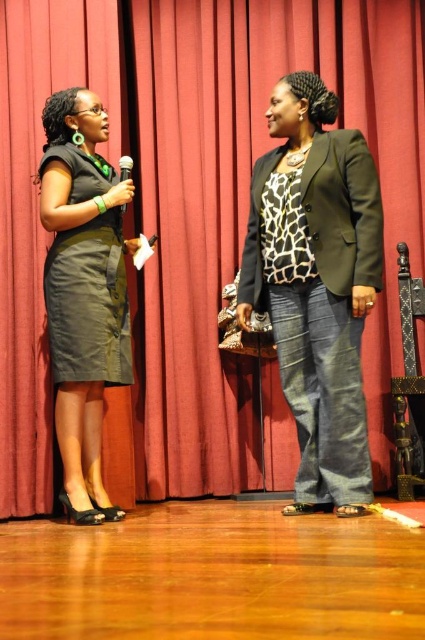
Does matte olive green skirt at left appear over metallic silver microphone at center?

Incorrect, matte olive green skirt at left is not positioned above metallic silver microphone at center.

Can you confirm if matte olive green skirt at left is positioned below metallic silver microphone at center?

Indeed, matte olive green skirt at left is positioned under metallic silver microphone at center.

Where is `matte olive green skirt at left`? Image resolution: width=425 pixels, height=640 pixels. matte olive green skirt at left is located at coordinates (88, 304).

Locate an element on the screen. matte olive green skirt at left is located at coordinates (88, 304).

Between matte green blazer at center and matte olive green skirt at left, which one is positioned higher?

matte olive green skirt at left is above.

Is point (277, 253) positioned after point (122, 372)?

That is False.

Which is in front, point (291, 243) or point (64, 248)?

Point (291, 243)

Find the location of `matte green blazer at center`. matte green blazer at center is located at coordinates (317, 284).

Does wooden floor at lower center appear on the left side of matte black dress at left?

Incorrect, wooden floor at lower center is not on the left side of matte black dress at left.

Between point (8, 563) and point (87, 333), which one is positioned in front?

Point (8, 563) is in front.

Which is in front, point (249, 611) or point (61, 106)?

Point (249, 611)

Identify the location of wooden floor at lower center. point(212,577).